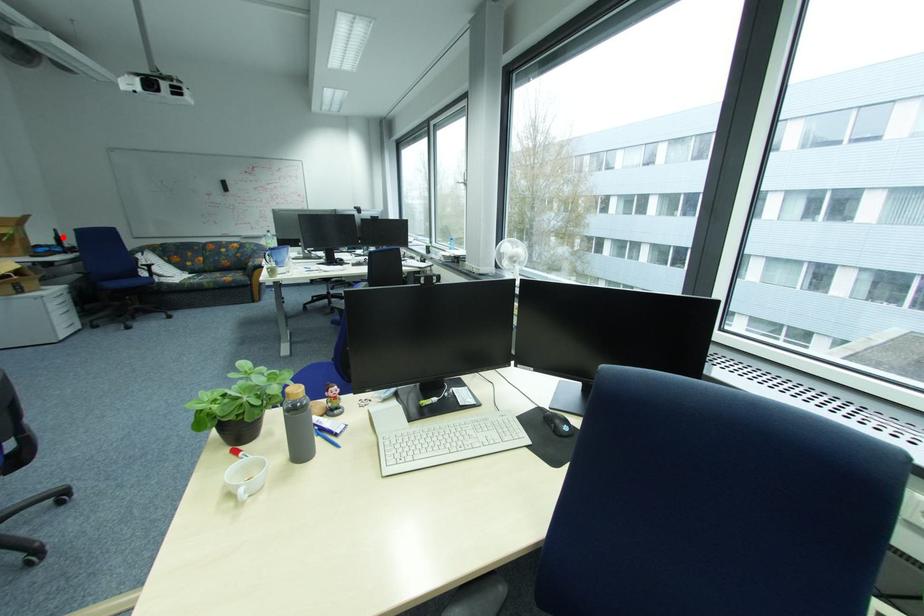
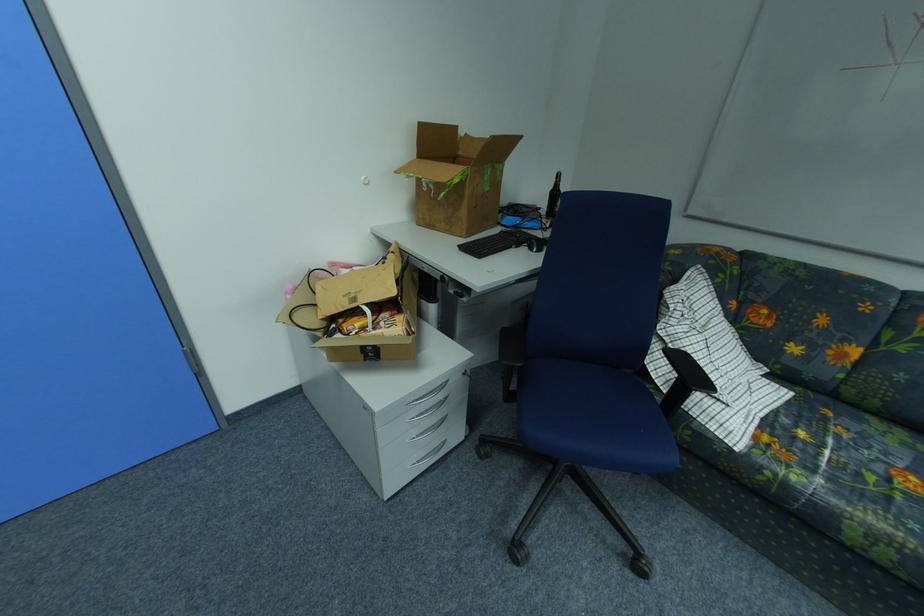
Question: I am providing you with two images of the same scene from different viewpoints. Given a red point in image1, look at the same physical point in image2. Is it:

Choices:
 (A) Closer to the viewpoint
 (B) Farther from the viewpoint

Answer: (A)